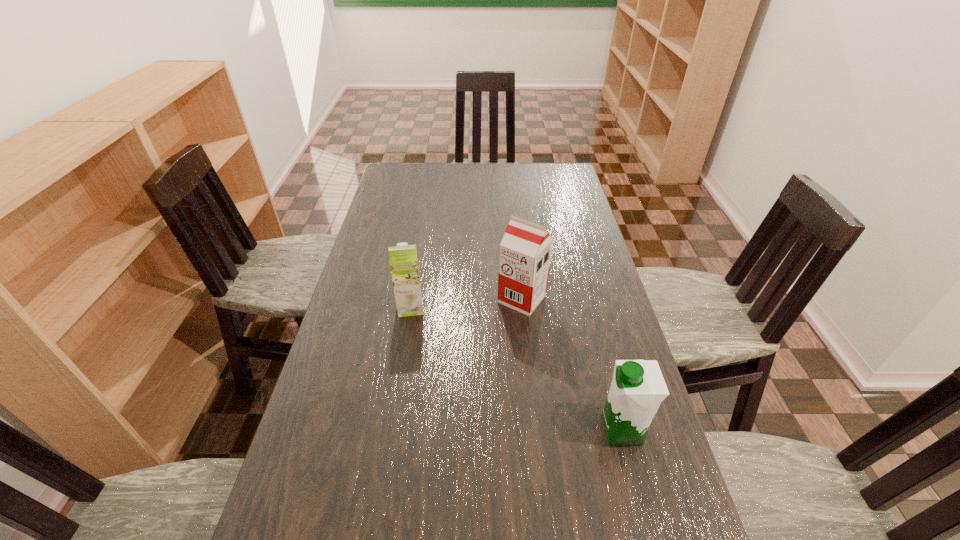
I want to click on object that stands as the closest to the rightmost object, so click(x=525, y=250).

I want to click on the closest object to the nearest object, so click(x=525, y=250).

This screenshot has width=960, height=540. In order to click on soya milk that stands as the second closest to the rightmost soya milk in this screenshot , I will do `click(403, 260)`.

Select which soya milk appears as the closest to the tallest soya milk. Please provide its 2D coordinates. Your answer should be formatted as a tuple, i.e. [(x, y)], where the tuple contains the x and y coordinates of a point satisfying the conditions above.

[(403, 260)]